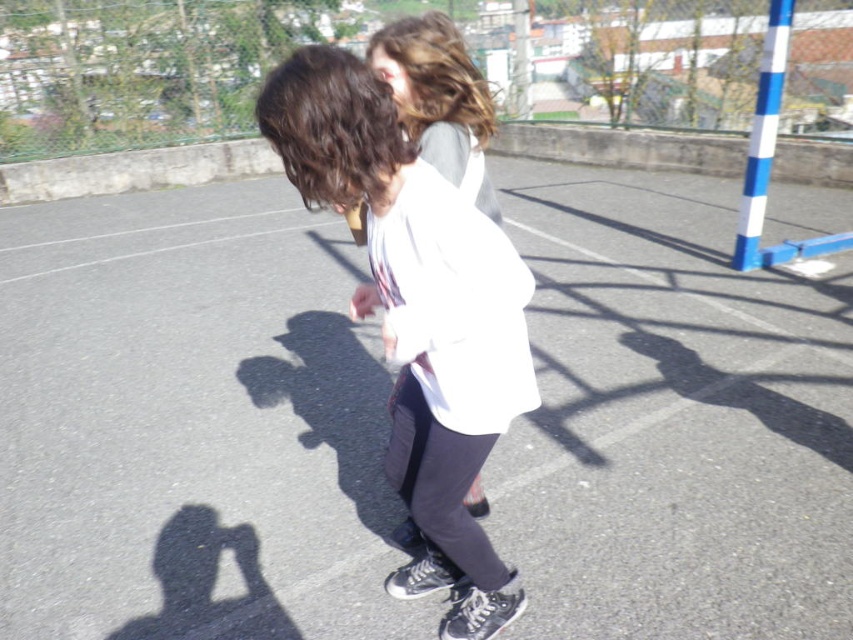
Question: In this image, where is white matte jacket at center located relative to white fabric at center?

Choices:
 (A) below
 (B) above

Answer: (A)

Question: Is white matte jacket at center above white fabric at center?

Choices:
 (A) yes
 (B) no

Answer: (B)

Question: Which point is farther to the camera?

Choices:
 (A) white matte jacket at center
 (B) white fabric at center

Answer: (B)

Question: Does white matte jacket at center have a lesser width compared to white fabric at center?

Choices:
 (A) yes
 (B) no

Answer: (B)